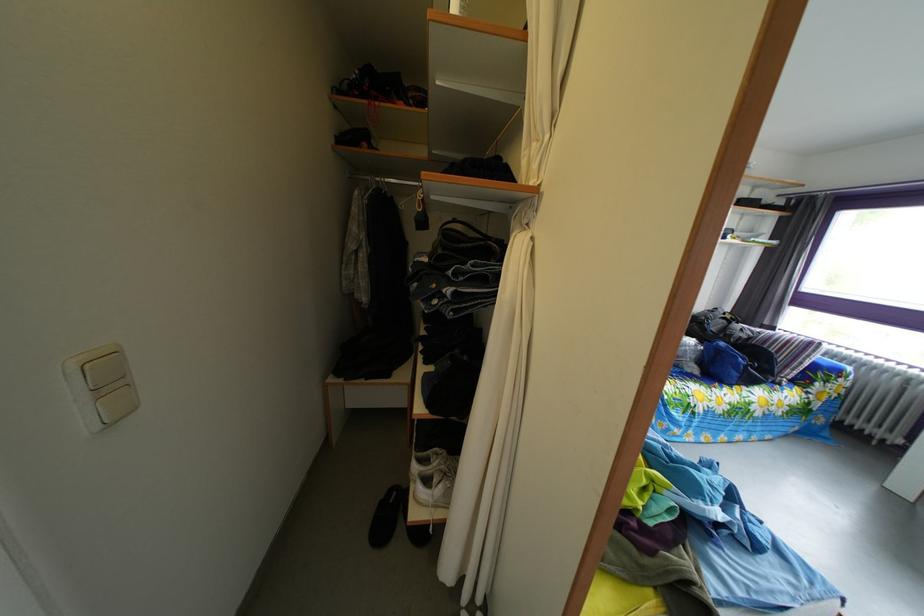
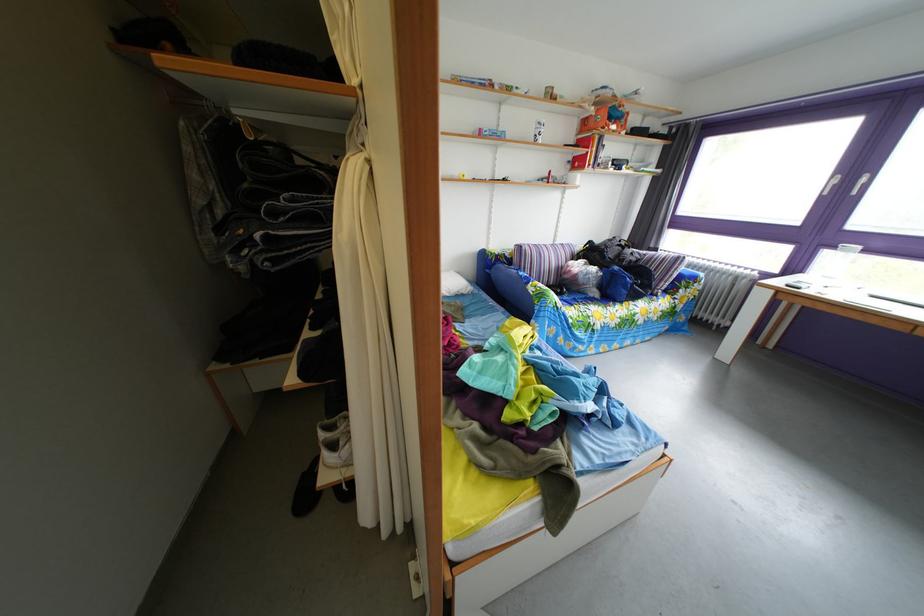
Question: Based on the continuous images, in which direction is the camera rotating? Reply with the corresponding letter.

Choices:
 (A) Left
 (B) Right
 (C) Up
 (D) Down

Answer: (B)